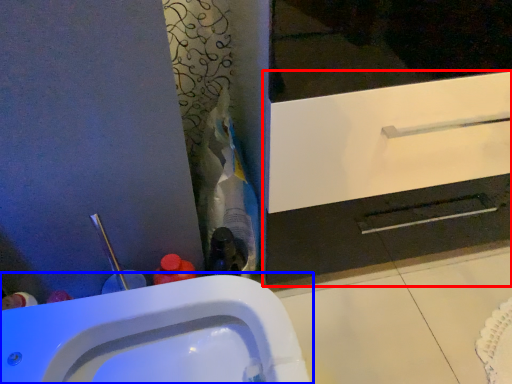
Question: Which of the following is the closest to the observer, bathroom cabinet (highlighted by a red box) or sink (highlighted by a blue box)?

Choices:
 (A) bathroom cabinet
 (B) sink

Answer: (B)